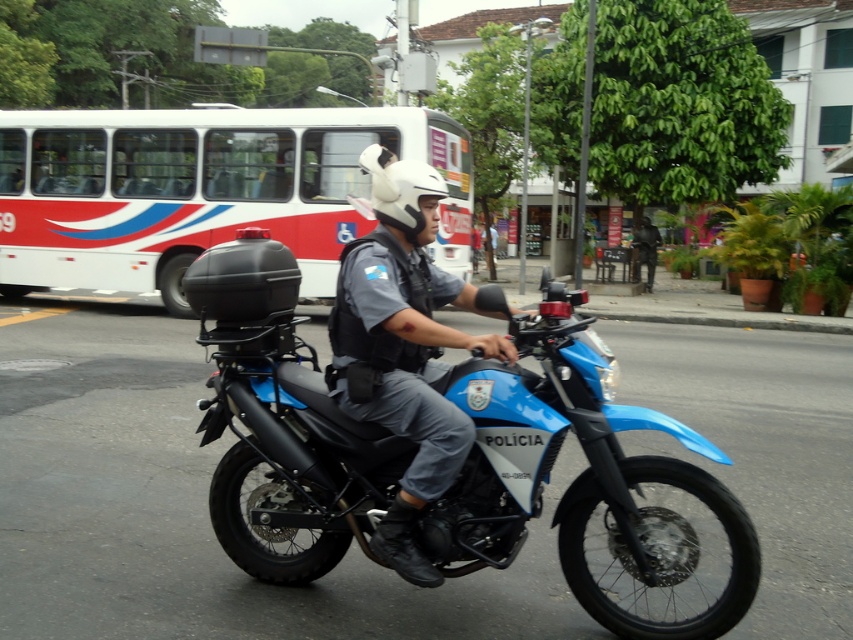
The height and width of the screenshot is (640, 853). What do you see at coordinates (579, 476) in the screenshot?
I see `blue matte/synthetic motorcycle at center` at bounding box center [579, 476].

Looking at this image, who is lower down, blue matte/synthetic motorcycle at center or white matte helmet at center?

blue matte/synthetic motorcycle at center

Which is in front, point (503, 397) or point (386, 186)?

Point (503, 397) is more forward.

At what (x,y) coordinates should I click in order to perform the action: click on blue matte/synthetic motorcycle at center. Please return your answer as a coordinate pair (x, y). Looking at the image, I should click on (579, 476).

Which is in front, point (32, 150) or point (408, 186)?

Point (408, 186) is in front.

Is white/red/striped bus at upper left to the left of white matte helmet at center from the viewer's perspective?

Indeed, white/red/striped bus at upper left is positioned on the left side of white matte helmet at center.

Is point (22, 221) positioned in front of point (407, 234)?

No, it is behind (407, 234).

Identify the location of white/red/striped bus at upper left. (202, 189).

How far apart are white/red/striped bus at upper left and matte black helmet at center?

white/red/striped bus at upper left is 32.94 feet away from matte black helmet at center.

Where is `white/red/striped bus at upper left`? Image resolution: width=853 pixels, height=640 pixels. white/red/striped bus at upper left is located at coordinates (202, 189).

Does point (294, 138) come behind point (354, 339)?

That is True.

Where is `white/red/striped bus at upper left`? Image resolution: width=853 pixels, height=640 pixels. white/red/striped bus at upper left is located at coordinates (202, 189).